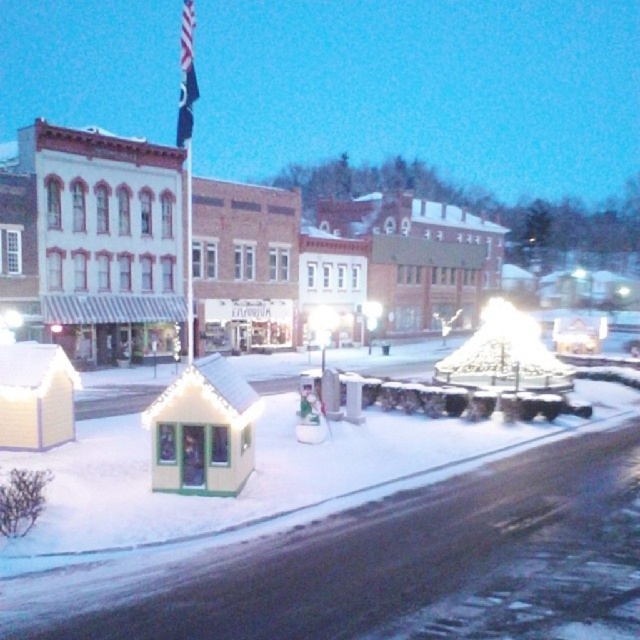
Question: Does brick building at center have a greater width compared to black fabric flag at upper center?

Choices:
 (A) no
 (B) yes

Answer: (B)

Question: Is brick building at center closer to the viewer compared to black fabric flag at upper center?

Choices:
 (A) no
 (B) yes

Answer: (A)

Question: Among these objects, which one is nearest to the camera?

Choices:
 (A) black fabric flag at upper center
 (B) brick building at center

Answer: (A)

Question: Which point is closer to the camera taking this photo?

Choices:
 (A) (184, 132)
 (B) (472, 308)

Answer: (A)

Question: Is brick building at center thinner than black fabric flag at upper center?

Choices:
 (A) yes
 (B) no

Answer: (B)